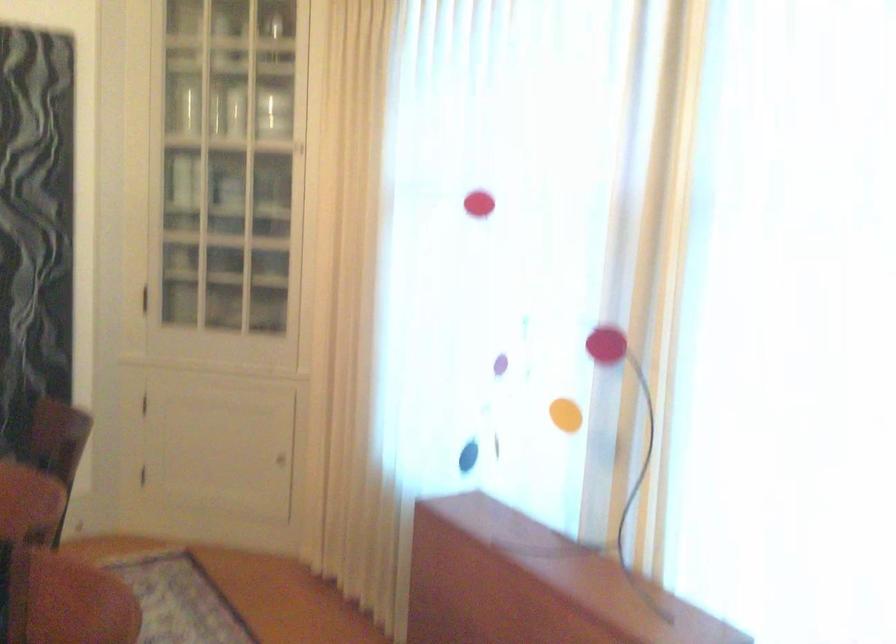
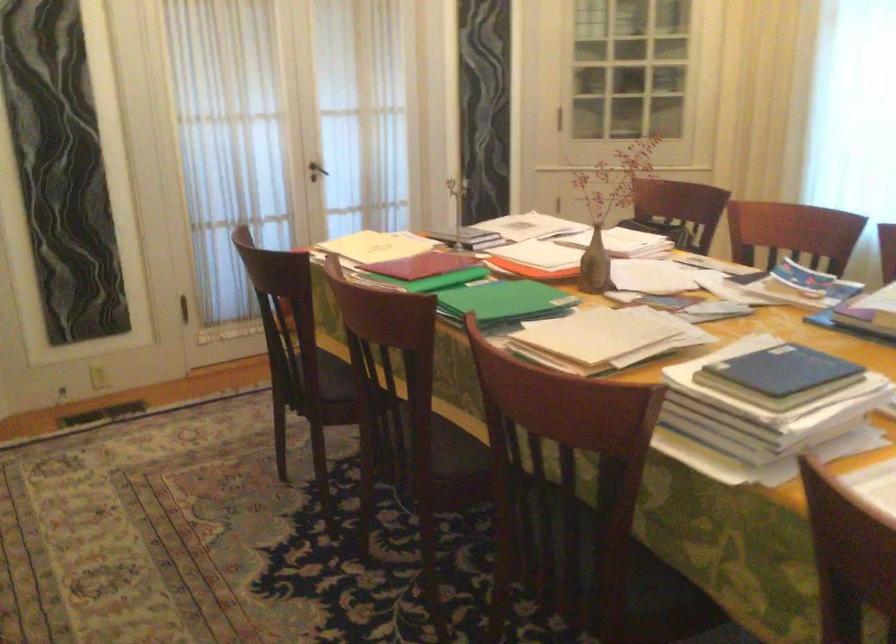
Question: I am providing you with two images of the same scene from different viewpoints. Which of the following objects are not visible in image2?

Choices:
 (A) white access panel handle
 (B) cabinet door handle
 (C) red folder
 (D) dark door handle

Answer: (B)